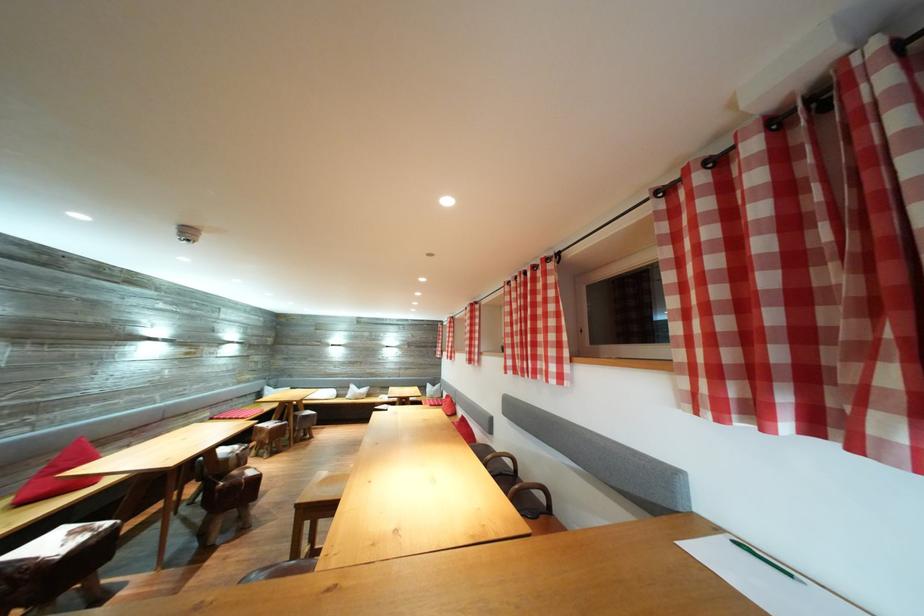
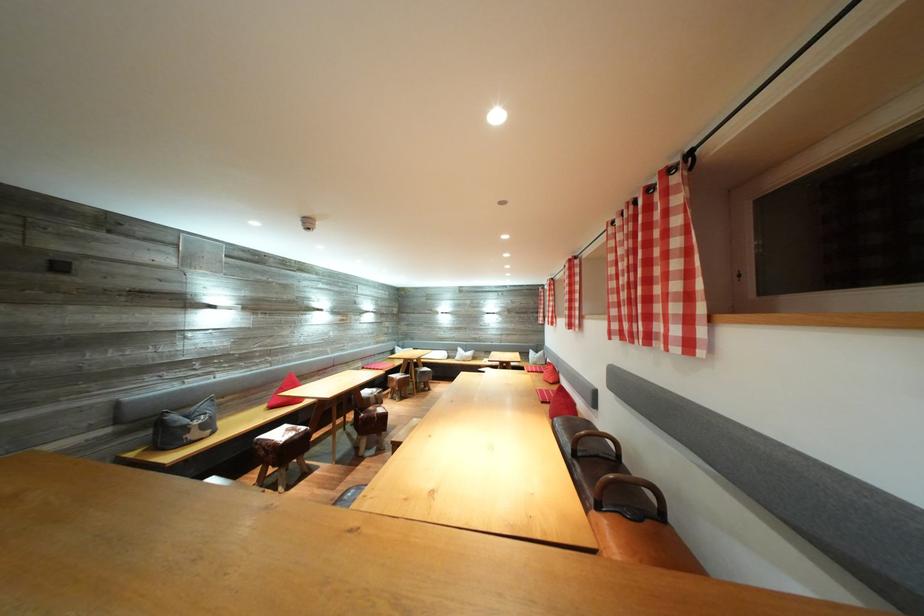
Where in the second image is the point corresponding to (524,492) from the first image?

(618, 482)